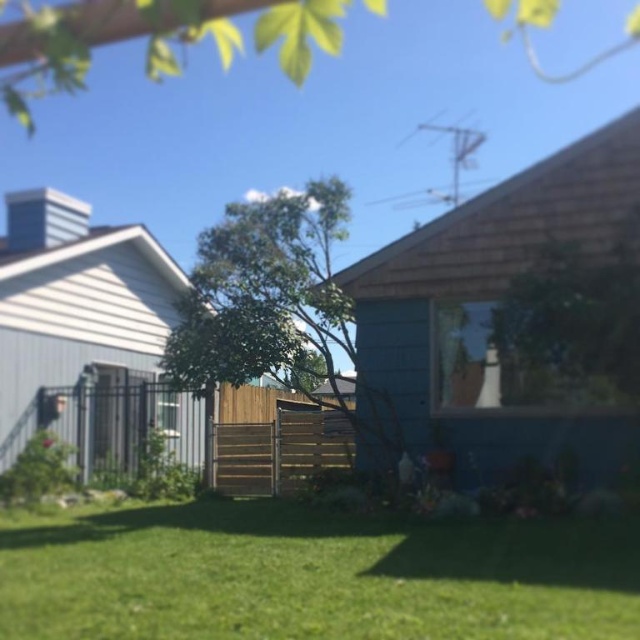
You are standing in the suburban backyard scene and want to know which of the two points, point (328,218) or point (227,4), is closer to you. Can you determine this based on their positions?

Point (227,4) is closer to you because it is less further to the camera than point (328,218) according to the description.

You are standing in the middle of the suburban backyard and want to take a photo of both the green leafy tree at center and the green leafy tree at upper center. Since you can only focus on one tree at a time, which tree should you adjust your camera focus to first to ensure the other tree is in the background?

You should focus on the green leafy tree at center first because the green leafy tree at upper center is behind it, so adjusting focus on the closer tree will keep the background tree in focus.

You are standing in the suburban backyard scene. There is a point marked at coordinates point [122,584]. If you want to place a 2 meter wide garden bench there, will it fit without overlapping any nearby objects? Please consider the distance from the viewer and the space available.

The point [122,584] is 6.54 meters from the viewer. Since the garden bench is 2 meters wide, there is sufficient space at that location to place it without overlapping nearby objects, assuming the area is clear.